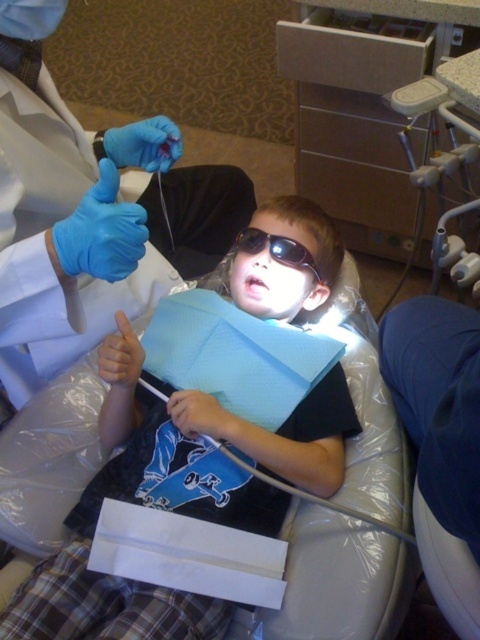
Question: Can you confirm if black plastic goggles at center is thinner than smooth skin mouth at center?

Choices:
 (A) no
 (B) yes

Answer: (A)

Question: Can you confirm if matte black shirt at center is thinner than blue latex gloves at upper left?

Choices:
 (A) yes
 (B) no

Answer: (B)

Question: Which point is closer to the camera taking this photo?

Choices:
 (A) (253, 227)
 (B) (238, 284)
 (C) (299, 298)

Answer: (C)

Question: Among these objects, which one is nearest to the camera?

Choices:
 (A) black plastic goggles at center
 (B) blue latex gloves at upper left

Answer: (B)

Question: Based on their relative distances, which object is farther from the black plastic goggles at center?

Choices:
 (A) smooth skin mouth at center
 (B) matte black shirt at center
 (C) blue latex gloves at upper left

Answer: (C)

Question: Does matte black shirt at center have a lesser width compared to blue latex gloves at upper left?

Choices:
 (A) no
 (B) yes

Answer: (A)